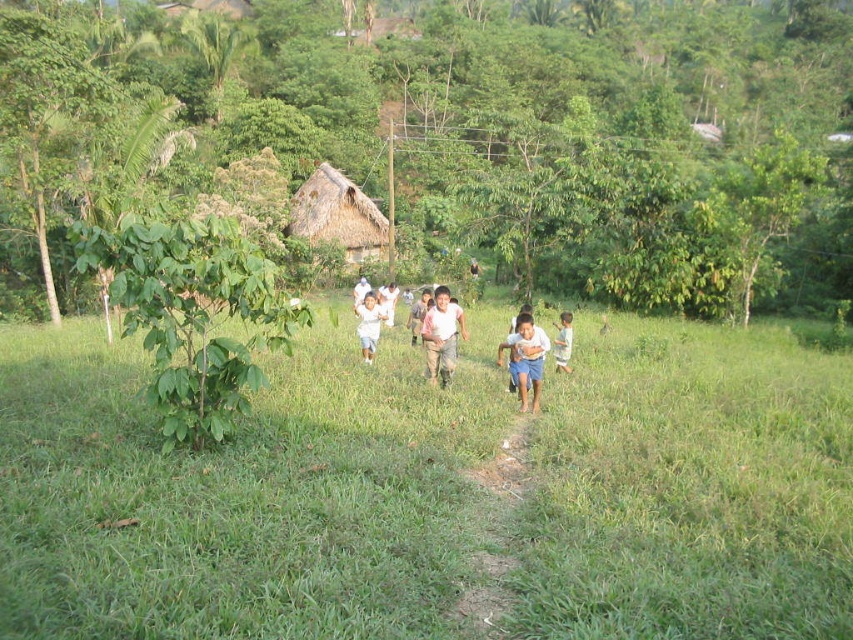
You are a photographer standing in the grassy field in the foreground of this rural scene. You want to take a photo that includes both point A at point (547, 483) and point B at point (561, 332). Which point should you focus on first to ensure both are in sharp focus?

You should focus on point A at point (547, 483) first because it is closer to the camera than point B at point (561, 332). This ensures the closer point is in focus, and due to depth of field, the farther point may also be acceptably sharp.

You are standing at the point marked by coordinates point (434, 492) in the image, which is in the center of the scene. Looking around, you see a group of children playing in the grassy field and some thatched huts in the midground. Which direction should you walk to reach the nearest thatched huts?

The point (434, 492) is at the center of the scene, where the green grass is located. Since the thatched huts are in the midground, you should walk forward or towards the background direction to reach them.

In the scene shown: You are a photographer trying to capture the children playing in the rural scene. You notice the green grass at center and the white cotton shirt at center. Which object is closer to the camera?

The green grass at center is closer to the camera because it is in front of the white cotton shirt at center.